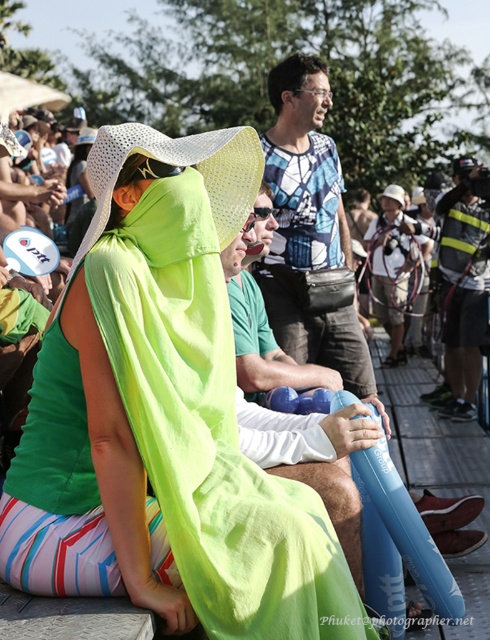
You are a photographer trying to capture a clear shot of the neon green towel at center and the neon green fabric robe at center. Since both are neon green, you need to adjust your camera angle to focus on their height differences. Which object should you aim higher to capture its full height?

The neon green towel at center is much taller than the neon green fabric robe at center, so you should aim higher to capture the full height of the neon green towel at center.

You are organizing a beach day and need to decide which item to use as a picnic blanket. You have the neon green towel at center and the neon green fabric robe at center. Which one would be more suitable based on their sizes?

The neon green towel at center is wider than the neon green fabric robe at center, making it more suitable as a picnic blanket.

You are a photographer standing at the edge of the crowd. You want to capture a photo that includes both the neon green towel at center and the neon green fabric robe at center. Which object will appear larger in your photo?

The neon green towel at center will appear larger in the photo because it is closer to the viewer than the neon green fabric robe at center.